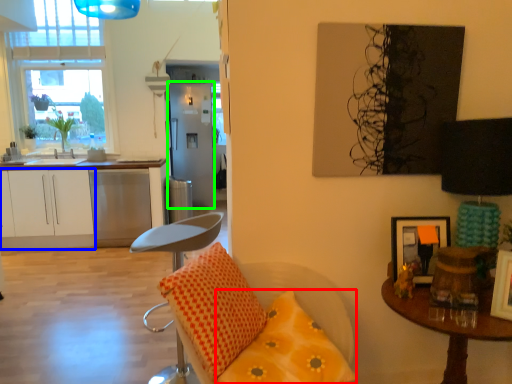
Question: Which is nearer to the pillow (highlighted by a red box)? cabinetry (highlighted by a blue box) or fridge (highlighted by a green box).

Choices:
 (A) cabinetry
 (B) fridge

Answer: (A)